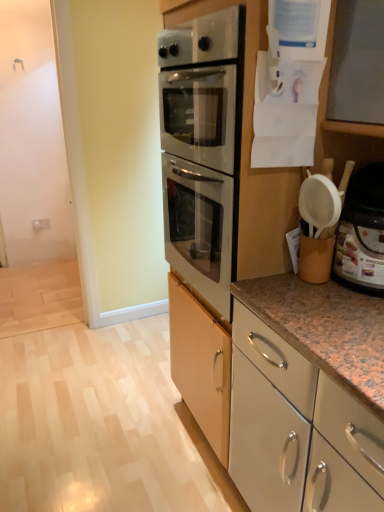
Question: Which direction should I rotate to face white glossy cabinet at center, which is counted as the second cabinetry, starting from the bottom, — up or down?

Choices:
 (A) down
 (B) up

Answer: (B)

Question: Does white glossy cabinet at lower right, the 1th cabinetry in the bottom-to-top sequence, have a lesser height compared to white glossy cabinet at center, which is counted as the first cabinetry, starting from the top?

Choices:
 (A) yes
 (B) no

Answer: (A)

Question: Is white glossy cabinet at lower right, the 1th cabinetry in the bottom-to-top sequence, not near white glossy cabinet at center, which is counted as the second cabinetry, starting from the bottom?

Choices:
 (A) no
 (B) yes

Answer: (A)

Question: Is white glossy cabinet at lower right, the 1th cabinetry in the bottom-to-top sequence, aimed at white glossy cabinet at center, which is counted as the second cabinetry, starting from the bottom?

Choices:
 (A) no
 (B) yes

Answer: (A)

Question: Is the depth of white glossy cabinet at lower right, arranged as the 2th cabinetry when viewed from the top, greater than that of white glossy cabinet at center, which is counted as the second cabinetry, starting from the bottom?

Choices:
 (A) yes
 (B) no

Answer: (A)

Question: Would you say white glossy cabinet at center, which is counted as the first cabinetry, starting from the top, is part of white glossy cabinet at lower right, the 1th cabinetry in the bottom-to-top sequence,'s contents?

Choices:
 (A) yes
 (B) no

Answer: (B)

Question: Can you confirm if white glossy cabinet at lower right, arranged as the 2th cabinetry when viewed from the top, is positioned to the left of white glossy cabinet at center, which is counted as the second cabinetry, starting from the bottom?

Choices:
 (A) yes
 (B) no

Answer: (A)

Question: Is the depth of white glossy cabinet at center, which is counted as the second cabinetry, starting from the bottom, greater than that of white glossy cabinet at lower right, arranged as the 2th cabinetry when viewed from the top?

Choices:
 (A) yes
 (B) no

Answer: (B)

Question: From the image's perspective, is white glossy cabinet at center, which is counted as the second cabinetry, starting from the bottom, under white glossy cabinet at lower right, the 1th cabinetry in the bottom-to-top sequence?

Choices:
 (A) yes
 (B) no

Answer: (B)

Question: Is white glossy cabinet at center, which is counted as the first cabinetry, starting from the top, outside white glossy cabinet at lower right, arranged as the 2th cabinetry when viewed from the top?

Choices:
 (A) yes
 (B) no

Answer: (A)

Question: Considering the relative sizes of white glossy cabinet at center, which is counted as the first cabinetry, starting from the top, and white glossy cabinet at lower right, the 1th cabinetry in the bottom-to-top sequence, in the image provided, is white glossy cabinet at center, which is counted as the first cabinetry, starting from the top, taller than white glossy cabinet at lower right, the 1th cabinetry in the bottom-to-top sequence,?

Choices:
 (A) yes
 (B) no

Answer: (A)

Question: Considering the relative sizes of white glossy cabinet at center, which is counted as the second cabinetry, starting from the bottom, and white glossy cabinet at lower right, arranged as the 2th cabinetry when viewed from the top, in the image provided, is white glossy cabinet at center, which is counted as the second cabinetry, starting from the bottom, thinner than white glossy cabinet at lower right, arranged as the 2th cabinetry when viewed from the top,?

Choices:
 (A) no
 (B) yes

Answer: (B)

Question: From a real-world perspective, is white glossy cabinet at center, which is counted as the second cabinetry, starting from the bottom, physically above white glossy cabinet at lower right, the 1th cabinetry in the bottom-to-top sequence?

Choices:
 (A) no
 (B) yes

Answer: (B)

Question: Does white plastic container at right come in front of white glossy cabinet at lower right, arranged as the 2th cabinetry when viewed from the top?

Choices:
 (A) yes
 (B) no

Answer: (A)